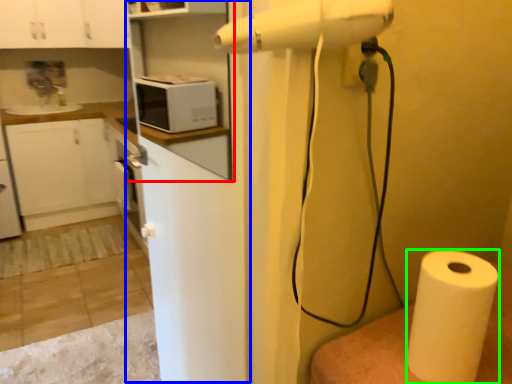
Question: Considering the real-world distances, which object is closest to shelf (highlighted by a red box)? screen door (highlighted by a blue box) or paper towel (highlighted by a green box).

Choices:
 (A) screen door
 (B) paper towel

Answer: (A)